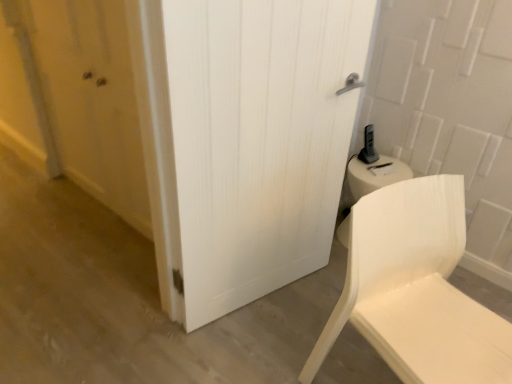
In order to face white wood door at center, should I rotate leftwards or rightwards?

Rotate right and turn 1.897 degrees.

At what (x,y) coordinates should I click in order to perform the action: click on matte wooden door at left. Please return your answer as a coordinate pair (x, y). The width and height of the screenshot is (512, 384). Looking at the image, I should click on (92, 100).

How distant is white wood door at center from white matte chair at lower right?

A distance of 21.08 inches exists between white wood door at center and white matte chair at lower right.

Would you say white wood door at center contains white matte chair at lower right?

No, white matte chair at lower right is located outside of white wood door at center.

Identify the location of chair below the white wood door at center (from the image's perspective). (416, 289).

From the image's perspective, between white wood door at center and white matte chair at lower right, who is located below?

white matte chair at lower right, from the image's perspective.

How different are the orientations of white matte chair at lower right and white wood door at center in degrees?

The angle between the facing direction of white matte chair at lower right and the facing direction of white wood door at center is 1.38 degrees.

Looking at the image, does white matte chair at lower right seem bigger or smaller compared to white wood door at center?

In the image, white matte chair at lower right appears to be larger than white wood door at center.

Considering the positions of objects white matte chair at lower right and white wood door at center in the image provided, who is more to the left, white matte chair at lower right or white wood door at center?

Positioned to the left is white wood door at center.

Is matte wooden door at left bigger than white wood door at center?

Actually, matte wooden door at left might be smaller than white wood door at center.

Locate an element on the screen. door above the matte wooden door at left (from a real-world perspective) is located at coordinates (258, 140).

From the picture: Between matte wooden door at left and white wood door at center, which one has smaller width?

matte wooden door at left is thinner.

Based on their positions, is matte wooden door at left located to the left or right of white wood door at center?

matte wooden door at left is positioned on white wood door at center's left side.

From the image's perspective, who appears lower, white matte chair at lower right or matte wooden door at left?

From the image's view, white matte chair at lower right is below.

Which object is closer to the camera, white matte chair at lower right or matte wooden door at left?

white matte chair at lower right is closer to the camera.

Is point (459, 229) in front of point (86, 81)?

Yes, point (459, 229) is closer to viewer.

In the image, is white matte chair at lower right on the left side or the right side of matte wooden door at left?

white matte chair at lower right is to the right of matte wooden door at left.

Does white wood door at center have a larger size compared to matte wooden door at left?

Yes, white wood door at center is bigger than matte wooden door at left.

Is there a large distance between white wood door at center and matte wooden door at left?

They are positioned close to each other.

Who is more distant, white wood door at center or matte wooden door at left?

matte wooden door at left is behind.

Which is more to the right, white wood door at center or matte wooden door at left?

white wood door at center.

Is matte wooden door at left completely or partially outside of white matte chair at lower right?

matte wooden door at left is positioned outside white matte chair at lower right.

Considering the relative positions of matte wooden door at left and white matte chair at lower right in the image provided, is matte wooden door at left in front of white matte chair at lower right?

No, matte wooden door at left is further to the viewer.

Is matte wooden door at left to the left or to the right of white matte chair at lower right in the image?

Clearly, matte wooden door at left is on the left of white matte chair at lower right in the image.

Where is `chair below the white wood door at center (from the image's perspective)`? Image resolution: width=512 pixels, height=384 pixels. chair below the white wood door at center (from the image's perspective) is located at coordinates (416, 289).

You are a GUI agent. You are given a task and a screenshot of the screen. Output one action in this format:
    pyautogui.click(x=<x>, y=<y>)
    Task: Click on the door positioned vertically above the white matte chair at lower right (from a real-world perspective)
    Image resolution: width=512 pixels, height=384 pixels.
    Given the screenshot: What is the action you would take?
    pyautogui.click(x=258, y=140)

Which object lies further to the anchor point matte wooden door at left, white matte chair at lower right or white wood door at center?

white matte chair at lower right is further to matte wooden door at left.

Considering their positions, is matte wooden door at left positioned further to white matte chair at lower right than white wood door at center?

matte wooden door at left is further to white matte chair at lower right.

Which object lies nearer to the anchor point matte wooden door at left, white wood door at center or white matte chair at lower right?

The object closer to matte wooden door at left is white wood door at center.

Estimate the real-world distances between objects in this image. Which object is further from white matte chair at lower right, white wood door at center or matte wooden door at left?

matte wooden door at left.

Based on their spatial positions, is matte wooden door at left or white matte chair at lower right closer to white wood door at center?

white matte chair at lower right lies closer to white wood door at center than the other object.

Looking at the image, which one is located further to white wood door at center, white matte chair at lower right or matte wooden door at left?

Among the two, matte wooden door at left is located further to white wood door at center.

Identify the location of door situated between matte wooden door at left and white matte chair at lower right from left to right. This screenshot has width=512, height=384. (258, 140).